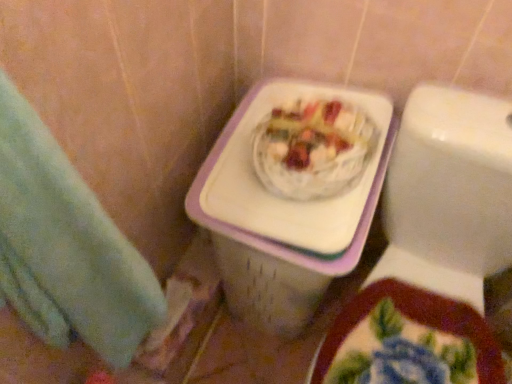
Question: Is white plastic basket at center positioned with its back to green towel at left?

Choices:
 (A) no
 (B) yes

Answer: (A)

Question: Is white plastic basket at center smaller than green towel at left?

Choices:
 (A) no
 (B) yes

Answer: (A)

Question: Considering the relative sizes of white plastic basket at center and green towel at left in the image provided, is white plastic basket at center wider than green towel at left?

Choices:
 (A) yes
 (B) no

Answer: (A)

Question: Could you tell me if white plastic basket at center is facing green towel at left?

Choices:
 (A) yes
 (B) no

Answer: (A)

Question: Would you say green towel at left is part of white plastic basket at center's contents?

Choices:
 (A) no
 (B) yes

Answer: (A)

Question: Is white plastic basket at center thinner than green towel at left?

Choices:
 (A) no
 (B) yes

Answer: (A)

Question: Is the depth of green towel at left greater than that of white plastic basket at center?

Choices:
 (A) no
 (B) yes

Answer: (A)

Question: Can you confirm if green towel at left is bigger than white plastic basket at center?

Choices:
 (A) no
 (B) yes

Answer: (A)

Question: From the image's perspective, is green towel at left on white plastic basket at center?

Choices:
 (A) no
 (B) yes

Answer: (A)

Question: Can you confirm if green towel at left is positioned to the left of white plastic basket at center?

Choices:
 (A) no
 (B) yes

Answer: (B)

Question: Does green towel at left have a smaller size compared to white plastic basket at center?

Choices:
 (A) yes
 (B) no

Answer: (A)

Question: Is white plastic basket at center at the back of green towel at left?

Choices:
 (A) no
 (B) yes

Answer: (A)

Question: Is white glossy toilet at upper right positioned behind white plastic basket at center?

Choices:
 (A) no
 (B) yes

Answer: (A)